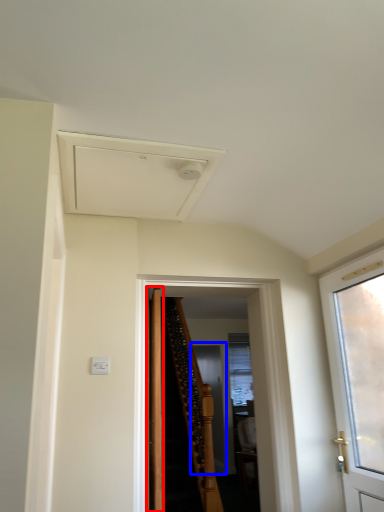
Question: Which of the following is the farthest to the observer, door (highlighted by a red box) or screen door (highlighted by a blue box)?

Choices:
 (A) door
 (B) screen door

Answer: (B)